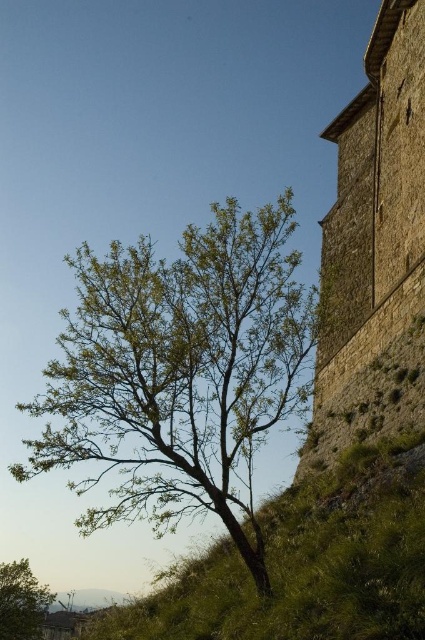
Can you confirm if green grassy at lower right is positioned to the right of brown stone tower at right?

Incorrect, green grassy at lower right is not on the right side of brown stone tower at right.

Can you confirm if green grassy at lower right is thinner than brown stone tower at right?

Incorrect, green grassy at lower right's width is not less than brown stone tower at right's.

Is point (401, 522) closer to camera compared to point (405, 348)?

Yes, point (401, 522) is in front of point (405, 348).

Where is `green grassy at lower right`? The width and height of the screenshot is (425, 640). green grassy at lower right is located at coordinates (308, 563).

Who is higher up, green leafy tree at center or green leafy tree at lower left?

Positioned higher is green leafy tree at center.

Which is behind, point (243, 396) or point (25, 621)?

Positioned behind is point (25, 621).

The width and height of the screenshot is (425, 640). Find the location of `green leafy tree at center`. green leafy tree at center is located at coordinates (178, 371).

Consider the image. Does green leafy tree at center have a smaller size compared to green grassy at lower right?

No, green leafy tree at center is not smaller than green grassy at lower right.

Does green leafy tree at center have a larger size compared to green grassy at lower right?

Yes, green leafy tree at center is bigger than green grassy at lower right.

Who is more distant from viewer, (110,364) or (393,627)?

Point (110,364)

I want to click on green leafy tree at center, so click(x=178, y=371).